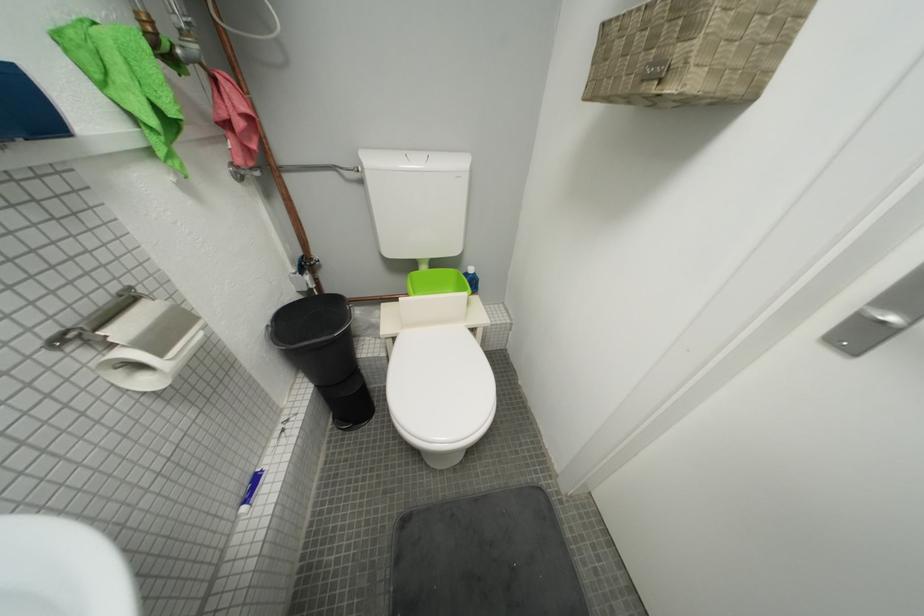
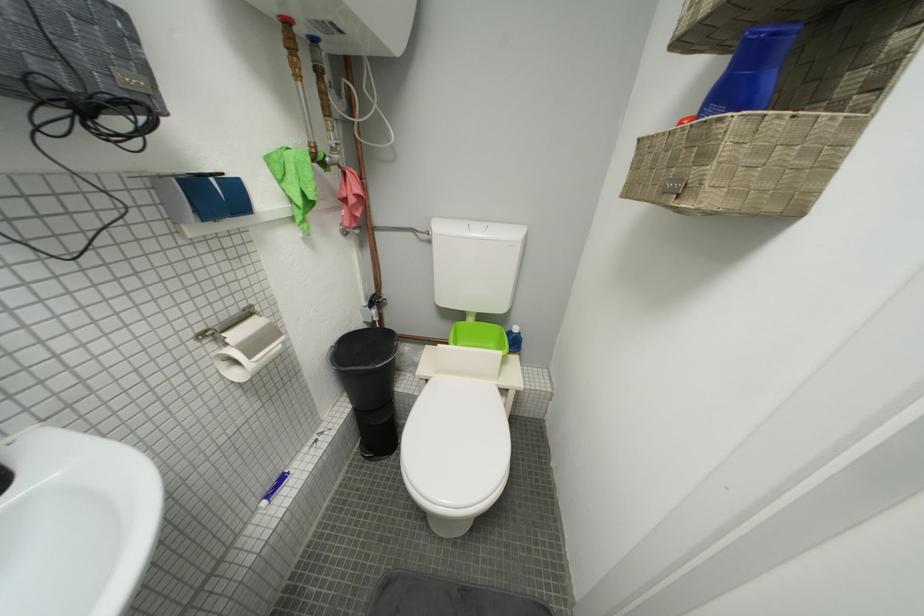
Question: The first image is from the beginning of the video and the second image is from the end. How did the camera likely rotate when shooting the video?

Choices:
 (A) Left
 (B) Right
 (C) Up
 (D) Down

Answer: (A)